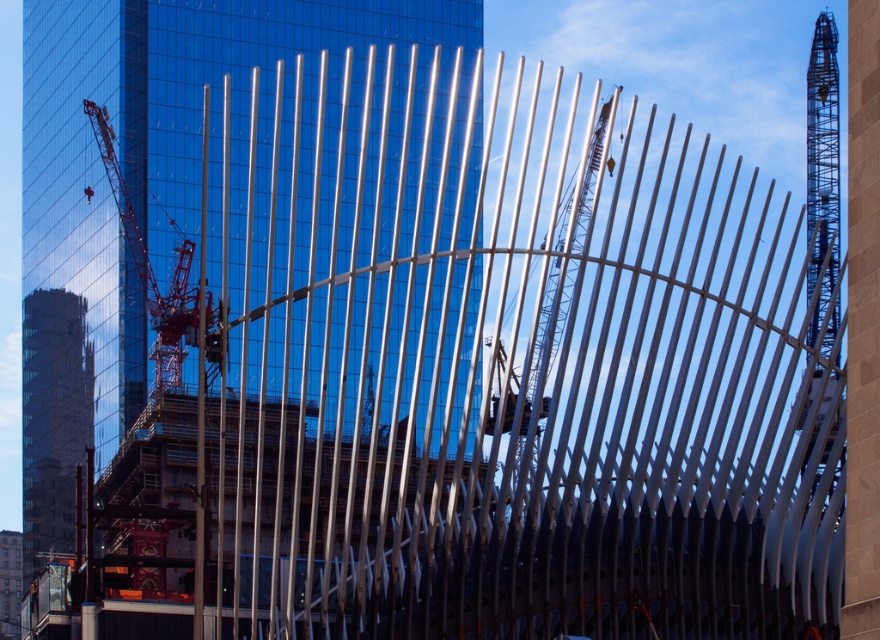
Question: Which point is farther to the camera?

Choices:
 (A) reddish-orange metallic crane at left
 (B) red reflective safety vest at center

Answer: (B)

Question: Is metallic silver crane at center smaller than red reflective safety vest at center?

Choices:
 (A) no
 (B) yes

Answer: (A)

Question: Which point is closer to the camera?

Choices:
 (A) (577, 193)
 (B) (92, 192)

Answer: (A)

Question: Which of the following is the closest to the observer?

Choices:
 (A) metallic silver crane at center
 (B) red reflective safety vest at center
 (C) reddish-orange metallic crane at left

Answer: (A)

Question: Is metallic silver crane at center above reddish-orange metallic crane at left?

Choices:
 (A) yes
 (B) no

Answer: (B)

Question: Is the position of metallic silver crane at center more distant than that of reddish-orange metallic crane at left?

Choices:
 (A) yes
 (B) no

Answer: (B)